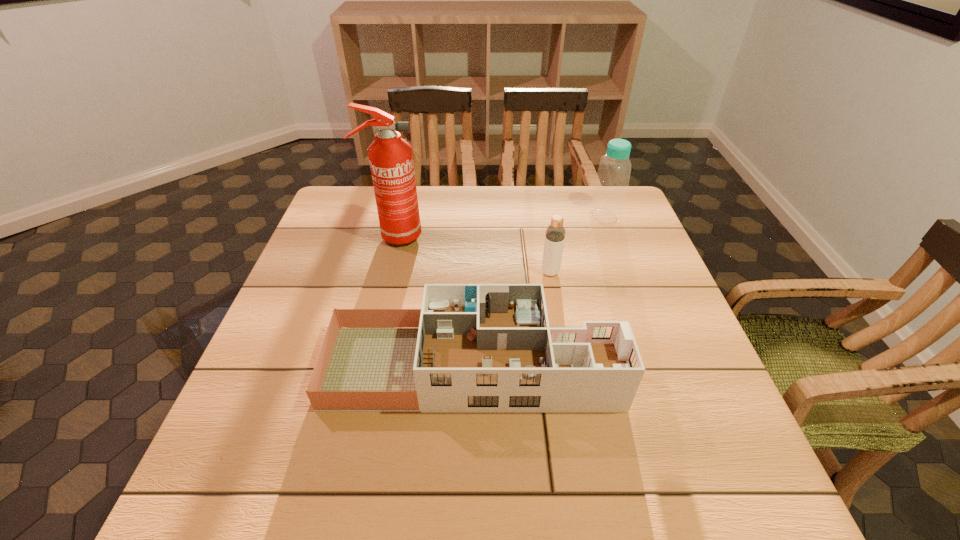
Image resolution: width=960 pixels, height=540 pixels. Identify the location of vacant space located at the entrance of the shortest object. [678, 366].

Locate an element on the screen. Image resolution: width=960 pixels, height=540 pixels. fire extinguisher positioned at the far edge is located at coordinates (391, 161).

Image resolution: width=960 pixels, height=540 pixels. In order to click on bottle located at the far edge in this screenshot , I will do `click(611, 184)`.

Where is `fire extinguisher at the left edge`? fire extinguisher at the left edge is located at coordinates click(391, 161).

I want to click on dollhouse present at the left edge, so click(472, 348).

This screenshot has height=540, width=960. Find the location of `object that is at the right edge`. object that is at the right edge is located at coordinates (611, 184).

I want to click on object present at the far left corner, so click(391, 161).

Locate an element on the screen. object positioned at the far right corner is located at coordinates (611, 184).

Locate an element on the screen. vacant space at the far edge of the desktop is located at coordinates (564, 201).

Where is `free location at the near edge of the desktop`? Image resolution: width=960 pixels, height=540 pixels. free location at the near edge of the desktop is located at coordinates point(629,480).